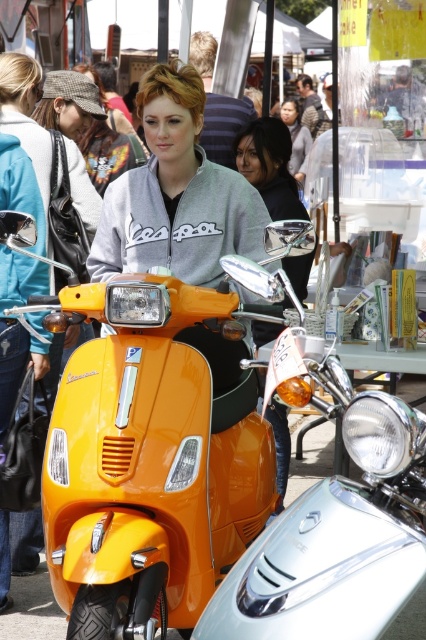
Question: Which point is farther from the camera taking this photo?

Choices:
 (A) (299, 176)
 (B) (255, 157)

Answer: (A)

Question: Does matte orange scooter at center appear on the left side of matte gray sweater at center?

Choices:
 (A) yes
 (B) no

Answer: (A)

Question: Which point appears closest to the camera in this image?

Choices:
 (A) (282, 481)
 (B) (296, 144)

Answer: (A)

Question: Which point is farther from the camera taking this photo?

Choices:
 (A) (302, 163)
 (B) (313, 252)

Answer: (A)

Question: Is matte orange scooter at center closer to camera compared to matte gray sweater at center?

Choices:
 (A) yes
 (B) no

Answer: (A)

Question: Observing the image, what is the correct spatial positioning of matte orange scooter at center in reference to matte gray sweater at center?

Choices:
 (A) left
 (B) right

Answer: (A)